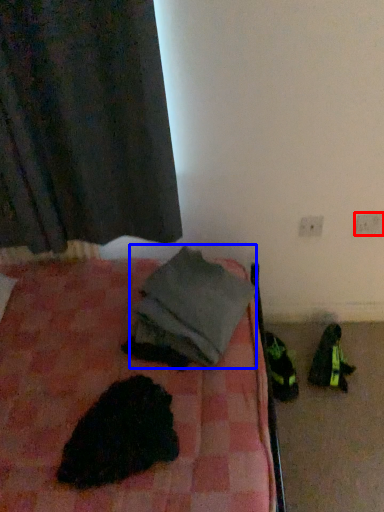
Question: Which of the following is the closest to the observer, electric outlet (highlighted by a red box) or clothing (highlighted by a blue box)?

Choices:
 (A) electric outlet
 (B) clothing

Answer: (B)